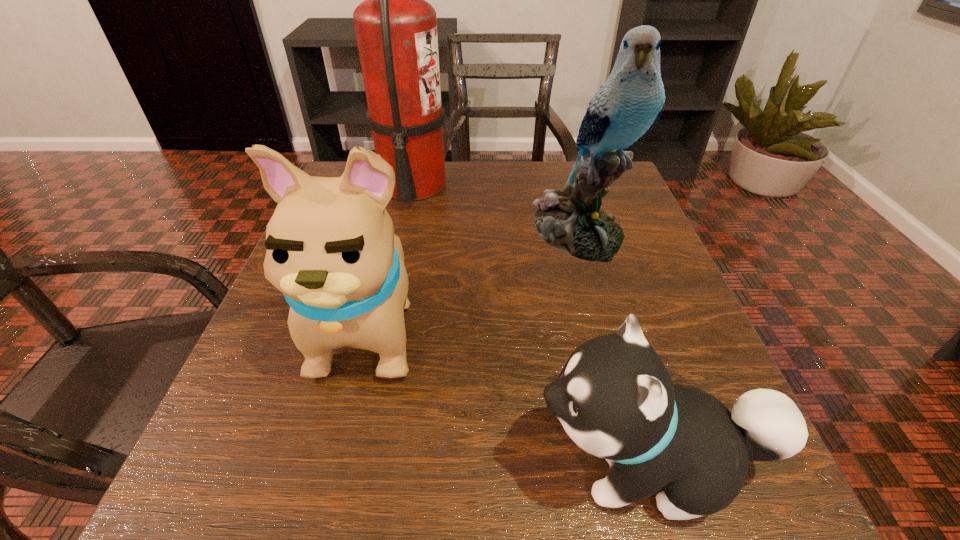
This screenshot has height=540, width=960. In order to click on object situated at the far right corner in this screenshot , I will do `click(627, 106)`.

This screenshot has height=540, width=960. I want to click on object that is at the near right corner, so click(614, 397).

You are a GUI agent. You are given a task and a screenshot of the screen. Output one action in this format:
    pyautogui.click(x=<x>, y=<y>)
    Task: Click on the free space at the far edge
    
    Given the screenshot: What is the action you would take?
    click(456, 171)

Locate an element on the screen. free location at the near edge is located at coordinates (403, 508).

In the image, there is a desktop. At what (x,y) coordinates should I click in order to perform the action: click on vacant region at the left edge. Please return your answer as a coordinate pair (x, y). Looking at the image, I should click on (229, 442).

Find the location of a particular element. This screenshot has height=540, width=960. blank space at the right edge of the desktop is located at coordinates click(x=645, y=222).

The width and height of the screenshot is (960, 540). What are the coordinates of `vacant point located between the left puppy and the nearer puppy` in the screenshot? It's located at (510, 395).

Where is `vacant area between the parakeet and the second shortest object`? vacant area between the parakeet and the second shortest object is located at coordinates (474, 279).

Find the location of a particular element. The height and width of the screenshot is (540, 960). free space between the nearest object and the left puppy is located at coordinates (510, 395).

This screenshot has width=960, height=540. What are the coordinates of `unoccupied area between the shorter puppy and the taller puppy` in the screenshot? It's located at (510, 395).